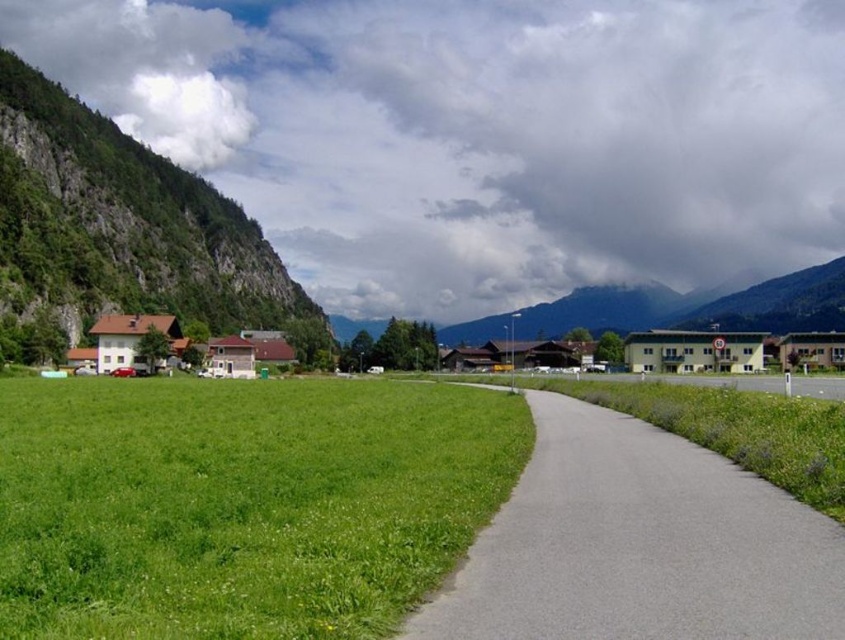
You are a landscape architect designing a new park. You need to decide where to place a new playground. The playground requires a large open space. Based on the image, which area between the green grass at lower left and the green rocky mountain at left is more suitable for the playground?

The green grass at lower left occupies less space than the green rocky mountain at left, so the green rocky mountain at left is more suitable for the playground as it provides a larger open area.

You are planning to walk along the gray asphalt path at center. To your left, there is green grass at lower left. Which side of the path has more space available for walking?

The green grass at lower left might be wider than the gray asphalt path at center, so the left side has more space available for walking.

You are standing at the start of the gray asphalt path at center and want to reach the brown wooden house at left. Which direction should you walk to get there?

To reach the brown wooden house at left from the gray asphalt path at center, you should walk towards the left side of the path since the house is located on the left side of the path.